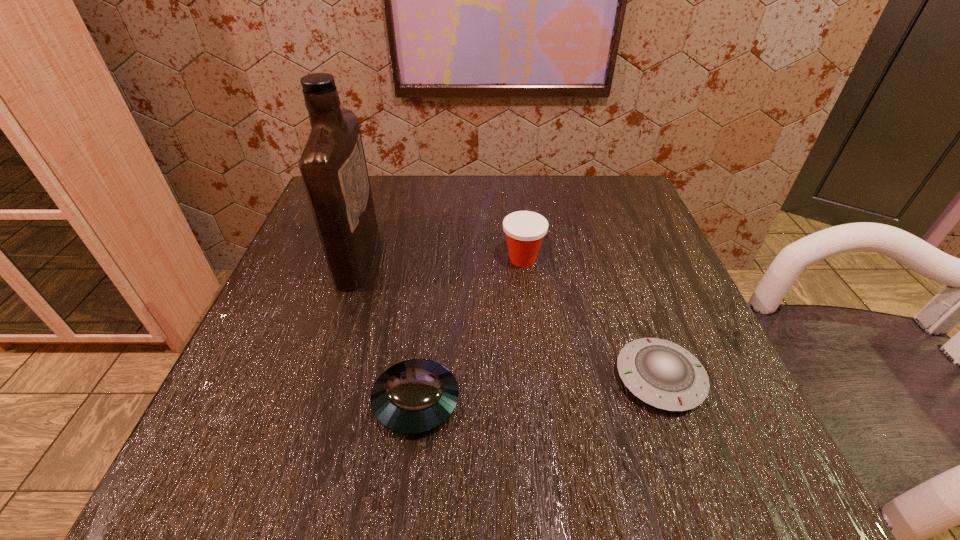
The height and width of the screenshot is (540, 960). Identify the location of liquor. (333, 167).

The height and width of the screenshot is (540, 960). In order to click on the tallest object in this screenshot , I will do `click(333, 167)`.

I want to click on the second object from right to left, so click(525, 230).

Where is `the second tallest object`? The image size is (960, 540). the second tallest object is located at coordinates (525, 230).

This screenshot has width=960, height=540. Identify the location of the third tallest object. (415, 396).

You are a GUI agent. You are given a task and a screenshot of the screen. Output one action in this format:
    pyautogui.click(x=<x>, y=<y>)
    Task: Click on the taller saucer
    
    Given the screenshot: What is the action you would take?
    tap(415, 396)

What are the coordinates of `the shortest object` in the screenshot? It's located at (663, 374).

Locate an element on the screen. The height and width of the screenshot is (540, 960). the shorter saucer is located at coordinates (663, 374).

At what (x,y) coordinates should I click in order to perform the action: click on free space located 0.300m on the label side of the leftmost object. Please return your answer as a coordinate pair (x, y). Image resolution: width=960 pixels, height=540 pixels. Looking at the image, I should click on (525, 255).

I want to click on vacant region located on the back of the Dixie cup, so click(x=518, y=218).